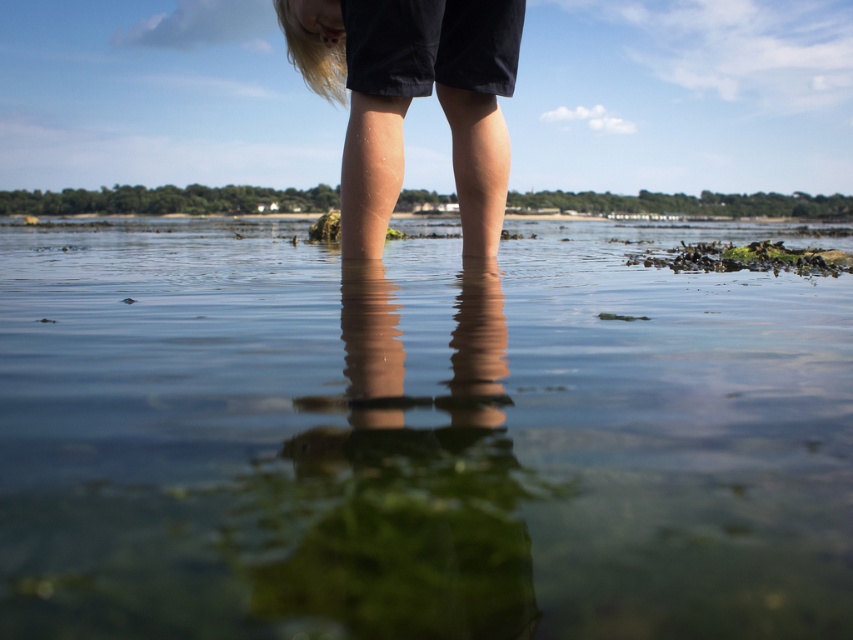
Looking at this image, measure the distance between point (376, 497) and camera.

Point (376, 497) and camera are 18.43 inches apart.

Between clear water at center and black matte shorts at center, which one appears on the right side from the viewer's perspective?

clear water at center

Does point (596, 376) lie in front of point (503, 20)?

Yes.

What are the coordinates of `clear water at center` in the screenshot? It's located at (416, 438).